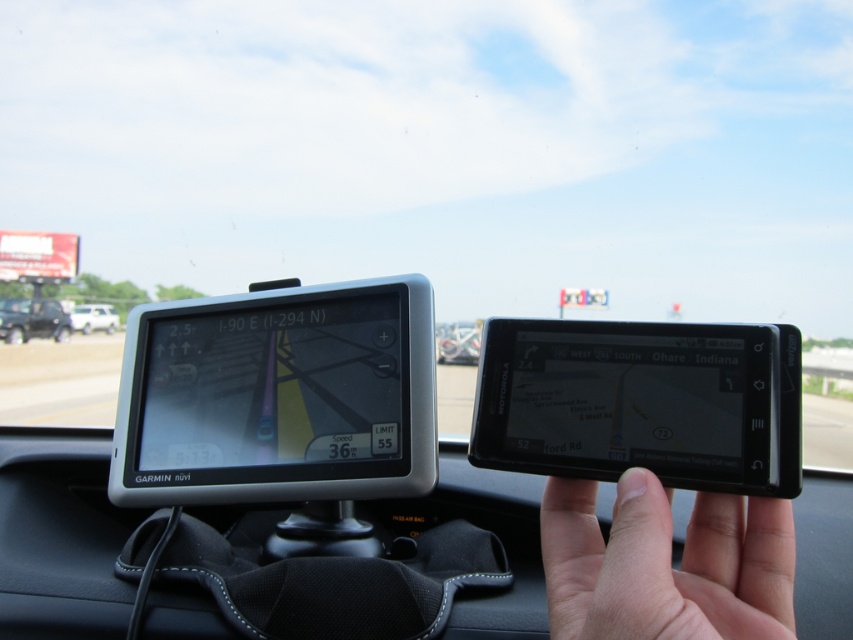
Who is more distant from viewer, (9,442) or (567,532)?

Point (9,442)

Is black plastic dashboard at center further to the viewer compared to skinny white hand at center?

Yes, black plastic dashboard at center is further from the viewer.

Between point (86, 586) and point (567, 493), which one is positioned behind?

Positioned behind is point (86, 586).

Identify the location of black plastic dashboard at center. This screenshot has height=640, width=853. (59, 536).

Is matte black suv at left to the right of metallic silver car at center from the viewer's perspective?

In fact, matte black suv at left is to the left of metallic silver car at center.

Find the location of a particular element. This screenshot has width=853, height=640. matte black suv at left is located at coordinates (32, 321).

Who is more forward, (x=27, y=300) or (x=460, y=362)?

Point (x=460, y=362) is more forward.

Locate an element on the screen. matte black suv at left is located at coordinates (32, 321).

Can you confirm if black glossy gps device at center is shorter than black plastic dashboard at center?

In fact, black glossy gps device at center may be taller than black plastic dashboard at center.

Can you confirm if black glossy gps device at center is thinner than black plastic dashboard at center?

Indeed, black glossy gps device at center has a lesser width compared to black plastic dashboard at center.

Which is in front, point (355, 481) or point (813, 616)?

Point (355, 481)

What are the coordinates of `black glossy gps device at center` in the screenshot? It's located at (277, 396).